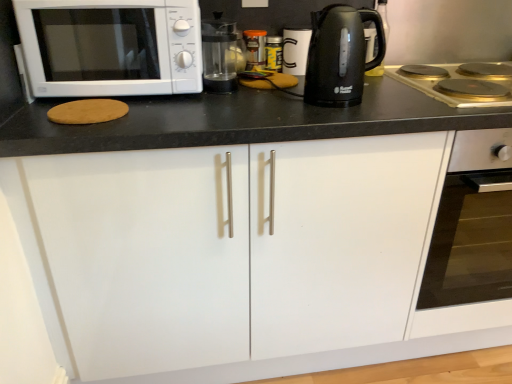
The width and height of the screenshot is (512, 384). Describe the element at coordinates (295, 50) in the screenshot. I see `white ceramic mug at upper center, which ranks as the 2th appliance in left-to-right order` at that location.

Locate an element on the screen. Image resolution: width=512 pixels, height=384 pixels. white matte cabinet at center is located at coordinates pos(234,253).

I want to click on metallic silver canister at center, acting as the 1th appliance starting from the left, so click(255, 48).

Is transparent glass coffee machine at center bigger or smaller than white matte cabinet at center?

Considering their sizes, transparent glass coffee machine at center takes up less space than white matte cabinet at center.

Looking at this image, can you confirm if transparent glass coffee machine at center is positioned to the left of white matte cabinet at center?

Yes.

Looking at this image, relative to white matte cabinet at center, is transparent glass coffee machine at center in front or behind?

transparent glass coffee machine at center is behind white matte cabinet at center.

Is metallic silver canister at center, acting as the 1th appliance starting from the left, positioned with its back to white matte cabinet at center?

No, metallic silver canister at center, acting as the 1th appliance starting from the left, is not facing away from white matte cabinet at center.

From the picture: From a real-world perspective, which object rests below the other?

In real-world perspective, white matte cabinet at center is lower.

Consider the image. Considering the relative positions of metallic silver canister at center, the 2th appliance in the right-to-left sequence, and white matte cabinet at center in the image provided, is metallic silver canister at center, the 2th appliance in the right-to-left sequence, to the left or to the right of white matte cabinet at center?

metallic silver canister at center, the 2th appliance in the right-to-left sequence, is to the left of white matte cabinet at center.

Considering the sizes of objects metallic silver canister at center, the 2th appliance in the right-to-left sequence, and white matte cabinet at center in the image provided, who is taller, metallic silver canister at center, the 2th appliance in the right-to-left sequence, or white matte cabinet at center?

With more height is white matte cabinet at center.

Starting from the black glossy electric kettle at upper right, which appliance is the 2nd one behind? Please provide its 2D coordinates.

[(255, 48)]

In terms of size, does metallic silver canister at center, acting as the 1th appliance starting from the left, appear bigger or smaller than black glossy electric kettle at upper right?

Considering their sizes, metallic silver canister at center, acting as the 1th appliance starting from the left, takes up less space than black glossy electric kettle at upper right.

Is metallic silver canister at center, acting as the 1th appliance starting from the left, in front of or behind black glossy electric kettle at upper right in the image?

metallic silver canister at center, acting as the 1th appliance starting from the left, is positioned farther from the viewer than black glossy electric kettle at upper right.

Does metallic silver canister at center, acting as the 1th appliance starting from the left, have a greater width compared to black glossy electric kettle at upper right?

No.

Consider the image. From the image's perspective, is black glossy electric kettle at upper right below white matte cabinet at center?

Actually, black glossy electric kettle at upper right appears above white matte cabinet at center in the image.

What's the angular difference between black glossy electric kettle at upper right and white matte cabinet at center's facing directions?

4.55 degrees.

Would you say white matte cabinet at center is part of black glossy electric kettle at upper right's contents?

Actually, white matte cabinet at center is outside black glossy electric kettle at upper right.

Where is `cabinetry that is on the right side of black glossy electric kettle at upper right`? cabinetry that is on the right side of black glossy electric kettle at upper right is located at coordinates (234, 253).

Would you say white matte cabinet at center is outside white ceramic mug at upper center, which ranks as the 2th appliance in left-to-right order?

Absolutely, white matte cabinet at center is external to white ceramic mug at upper center, which ranks as the 2th appliance in left-to-right order.

Is white matte cabinet at center aimed at white ceramic mug at upper center, the 1th appliance from the right?

No, white matte cabinet at center is not turned towards white ceramic mug at upper center, the 1th appliance from the right.

From the picture: From their relative heights in the image, would you say white matte cabinet at center is taller or shorter than white ceramic mug at upper center, which ranks as the 2th appliance in left-to-right order?

white matte cabinet at center is taller than white ceramic mug at upper center, which ranks as the 2th appliance in left-to-right order.

From a real-world perspective, is white matte cabinet at center physically located above or below white ceramic mug at upper center, the 1th appliance from the right?

In terms of real-world spatial position, white matte cabinet at center is below white ceramic mug at upper center, the 1th appliance from the right.

Considering the sizes of objects white matte microwave at left and metallic silver canister at center, the 2th appliance in the right-to-left sequence, in the image provided, who is smaller, white matte microwave at left or metallic silver canister at center, the 2th appliance in the right-to-left sequence,?

metallic silver canister at center, the 2th appliance in the right-to-left sequence, is smaller.

Is white matte microwave at left taller than metallic silver canister at center, acting as the 1th appliance starting from the left?

Yes.

Does white matte microwave at left appear on the left side of metallic silver canister at center, the 2th appliance in the right-to-left sequence?

Yes, white matte microwave at left is to the left of metallic silver canister at center, the 2th appliance in the right-to-left sequence.

Is black glossy electric kettle at upper right far away from gold-coated stovetop at right?

black glossy electric kettle at upper right is near gold-coated stovetop at right, not far away.

Between black glossy electric kettle at upper right and gold-coated stovetop at right, which one has larger size?

gold-coated stovetop at right is bigger.

Between point (354, 104) and point (432, 83), which one is positioned in front?

The point (354, 104) is closer to the camera.

This screenshot has height=384, width=512. I want to click on cabinetry in front of the transparent glass coffee machine at center, so click(234, 253).

This screenshot has width=512, height=384. I want to click on cabinetry below the metallic silver canister at center, the 2th appliance in the right-to-left sequence (from the image's perspective), so click(x=234, y=253).

Estimate the real-world distances between objects in this image. Which object is further from black glossy electric kettle at upper right, white ceramic mug at upper center, which ranks as the 2th appliance in left-to-right order, or gold-coated stovetop at right?

white ceramic mug at upper center, which ranks as the 2th appliance in left-to-right order, lies further to black glossy electric kettle at upper right than the other object.

Looking at the image, which one is located closer to white matte cabinet at center, white matte microwave at left or transparent glass coffee machine at center?

white matte microwave at left is positioned closer to the anchor white matte cabinet at center.

Based on their spatial positions, is gold-coated stovetop at right or white matte microwave at left further from black glossy electric kettle at upper right?

white matte microwave at left is further to black glossy electric kettle at upper right.

Based on the photo, from the image, which object appears to be nearer to white matte cabinet at center, metallic silver canister at center, acting as the 1th appliance starting from the left, or transparent glass coffee machine at center?

transparent glass coffee machine at center lies closer to white matte cabinet at center than the other object.

Considering their positions, is black glossy electric kettle at upper right positioned closer to white ceramic mug at upper center, the 1th appliance from the right, than white matte cabinet at center?

The object closer to white ceramic mug at upper center, the 1th appliance from the right, is black glossy electric kettle at upper right.

From the image, which object appears to be nearer to gold-coated stovetop at right, white matte microwave at left or white matte cabinet at center?

white matte cabinet at center is closer to gold-coated stovetop at right.

From the picture: Considering their positions, is transparent glass coffee machine at center positioned closer to gold-coated stovetop at right than white matte cabinet at center?

transparent glass coffee machine at center is closer to gold-coated stovetop at right.

Estimate the real-world distances between objects in this image. Which object is closer to transparent glass coffee machine at center, white matte cabinet at center or white matte microwave at left?

white matte microwave at left.

Find the location of `coffee machine between white matte microwave at left and metallic silver canister at center, acting as the 1th appliance starting from the left, in the front-back direction`. coffee machine between white matte microwave at left and metallic silver canister at center, acting as the 1th appliance starting from the left, in the front-back direction is located at coordinates point(220,55).

The image size is (512, 384). What are the coordinates of `coffee machine between white ceramic mug at upper center, the 1th appliance from the right, and white matte cabinet at center from top to bottom` in the screenshot? It's located at (220, 55).

Where is `coffee machine situated between white matte microwave at left and white ceramic mug at upper center, the 1th appliance from the right, from left to right`? The image size is (512, 384). coffee machine situated between white matte microwave at left and white ceramic mug at upper center, the 1th appliance from the right, from left to right is located at coordinates (220, 55).

The height and width of the screenshot is (384, 512). Identify the location of kitchen appliance situated between metallic silver canister at center, the 2th appliance in the right-to-left sequence, and gold-coated stovetop at right from left to right. (340, 55).